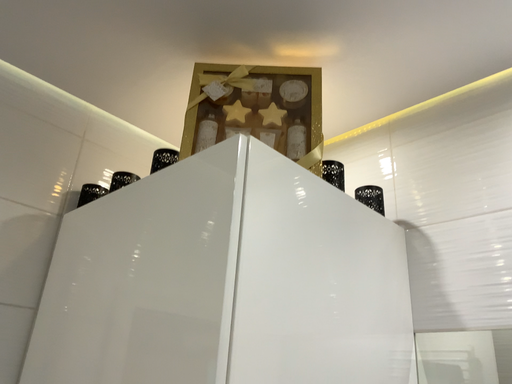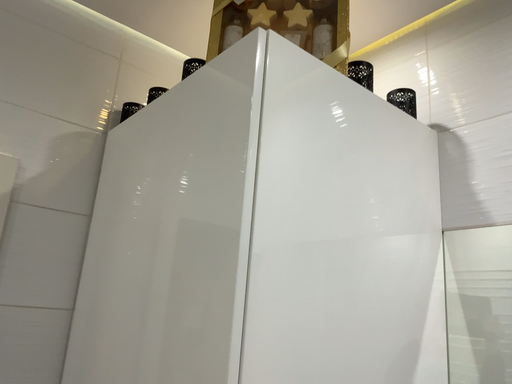
Question: How did the camera likely rotate when shooting the video?

Choices:
 (A) rotated downward
 (B) rotated upward

Answer: (A)